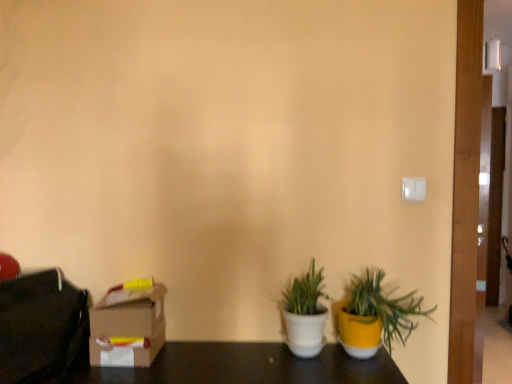
Question: Which is correct: yellow matte pot at lower right, the second houseplant in the left-to-right sequence, is inside cardboard box at lower left, or outside of it?

Choices:
 (A) outside
 (B) inside

Answer: (A)

Question: Relative to cardboard box at lower left, is yellow matte pot at lower right, the second houseplant in the left-to-right sequence, in front or behind?

Choices:
 (A) front
 (B) behind

Answer: (A)

Question: Which object is the farthest from the yellow matte pot at lower right, which is the 1th houseplant in right-to-left order?

Choices:
 (A) white matte pot at center, which ranks as the first houseplant in left-to-right order
 (B) matte black bag at left
 (C) cardboard box at lower left

Answer: (B)

Question: Considering the real-world distances, which object is farthest from the white matte pot at center, the second houseplant viewed from the right?

Choices:
 (A) matte black bag at left
 (B) yellow matte pot at lower right, the second houseplant in the left-to-right sequence
 (C) cardboard box at lower left

Answer: (A)